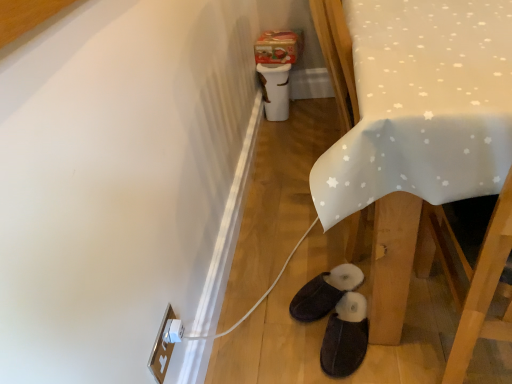
At what (x,y) coordinates should I click in order to perform the action: click on free point in front of black suede slippers at lower center, arranged as the second footwear when viewed from the front. Please return your answer as a coordinate pair (x, y). Looking at the image, I should click on (320, 354).